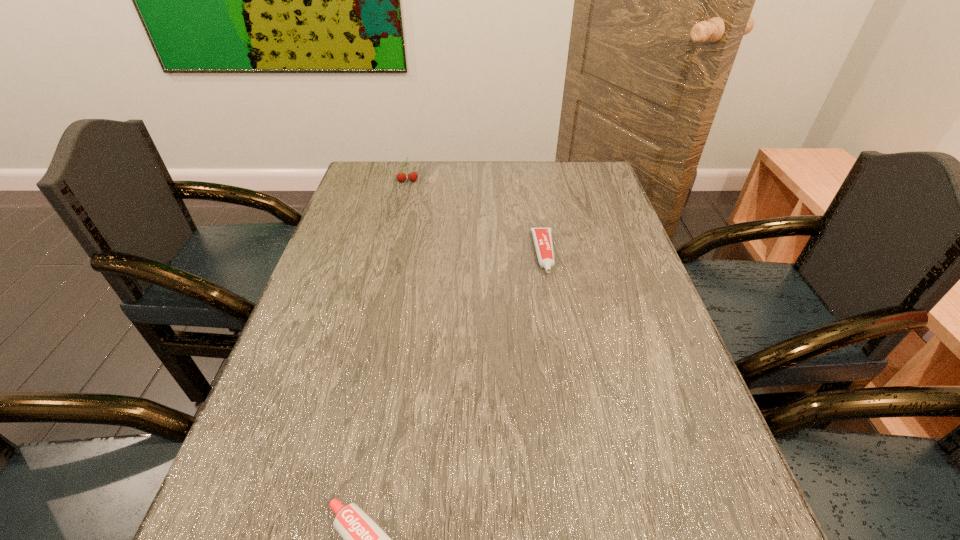
Select which object is the second closest to the nearer toothpaste. Please provide its 2D coordinates. Your answer should be formatted as a tuple, i.e. [(x, y)], where the tuple contains the x and y coordinates of a point satisfying the conditions above.

[(401, 177)]